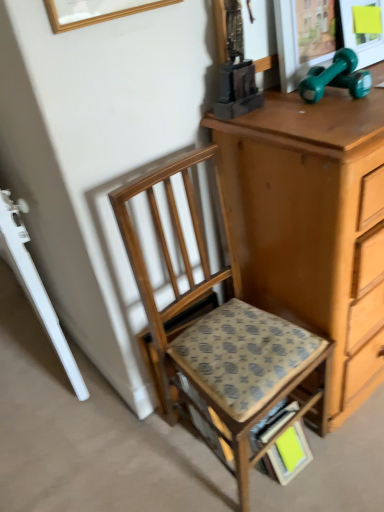
Question: Is wooden chair at center facing towards wooden picture frame at upper center?

Choices:
 (A) no
 (B) yes

Answer: (A)

Question: Considering the relative positions of wooden chair at center and wooden picture frame at upper center in the image provided, is wooden chair at center to the left of wooden picture frame at upper center from the viewer's perspective?

Choices:
 (A) no
 (B) yes

Answer: (A)

Question: Is wooden chair at center thinner than wooden picture frame at upper center?

Choices:
 (A) yes
 (B) no

Answer: (B)

Question: Is wooden picture frame at upper center inside wooden chair at center?

Choices:
 (A) no
 (B) yes

Answer: (A)

Question: From a real-world perspective, is wooden chair at center under wooden picture frame at upper center?

Choices:
 (A) yes
 (B) no

Answer: (A)

Question: Does wooden chair at center appear on the right side of wooden picture frame at upper center?

Choices:
 (A) yes
 (B) no

Answer: (A)

Question: Is patterned fabric step stool at center positioned beyond the bounds of wooden picture frame at upper center?

Choices:
 (A) no
 (B) yes

Answer: (B)

Question: From a real-world perspective, is patterned fabric step stool at center positioned over wooden picture frame at upper center based on gravity?

Choices:
 (A) no
 (B) yes

Answer: (A)

Question: From a real-world perspective, does patterned fabric step stool at center sit lower than wooden picture frame at upper center?

Choices:
 (A) yes
 (B) no

Answer: (A)

Question: Is patterned fabric step stool at center turned away from wooden picture frame at upper center?

Choices:
 (A) yes
 (B) no

Answer: (B)

Question: Is patterned fabric step stool at center aimed at wooden picture frame at upper center?

Choices:
 (A) yes
 (B) no

Answer: (B)

Question: Would you say patterned fabric step stool at center is a long distance from wooden picture frame at upper center?

Choices:
 (A) yes
 (B) no

Answer: (B)

Question: Can you confirm if wooden picture frame at upper center is bigger than patterned fabric step stool at center?

Choices:
 (A) no
 (B) yes

Answer: (A)